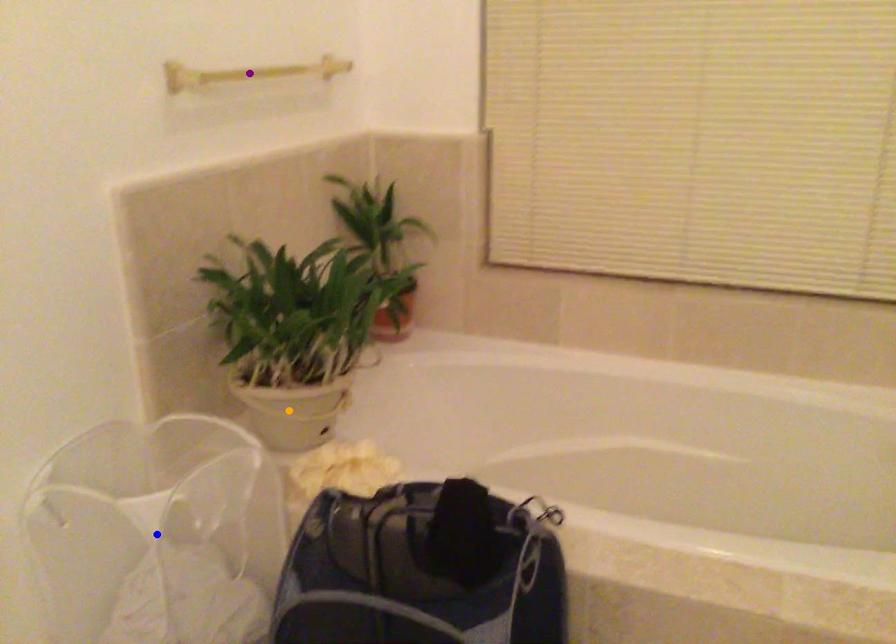
Order these from nearest to farthest:
blue point
purple point
orange point

blue point, orange point, purple point